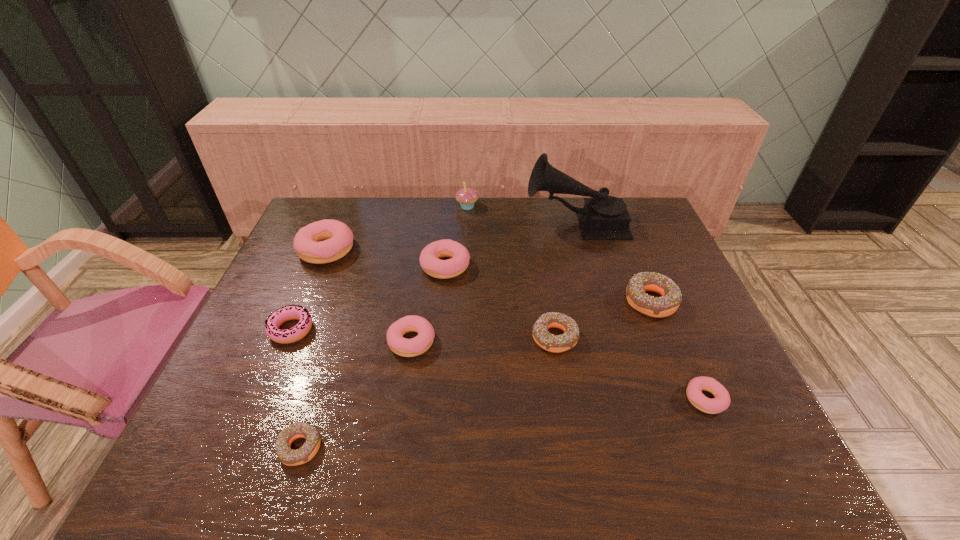
Find the location of a particular element. free spot between the pink cupcake and the tallest doughnut is located at coordinates (397, 228).

Find the location of a particular element. This screenshot has height=540, width=960. unoccupied position between the biggest pink doughnut and the smallest chocolate doughnut is located at coordinates (313, 349).

Locate an element on the screen. The image size is (960, 540). vacant area that lies between the nearest chocolate doughnut and the second biggest pink doughnut is located at coordinates (372, 357).

The width and height of the screenshot is (960, 540). What are the coordinates of `free space that is in between the second biggest pink doughnut and the leftmost chocolate doughnut` in the screenshot? It's located at (372, 357).

At what (x,y) coordinates should I click in order to perform the action: click on free space between the fourth smallest pink doughnut and the second tallest object. Please return your answer as a coordinate pair (x, y). The height and width of the screenshot is (540, 960). Looking at the image, I should click on (457, 237).

I want to click on vacant area between the second smallest chocolate doughnut and the tallest doughnut, so click(441, 294).

The image size is (960, 540). What are the coordinates of `object that is the seventh closest one to the black phonograph_record` in the screenshot? It's located at (325, 241).

Locate an element on the screen. The image size is (960, 540). object that ranks as the fifth closest to the nearest pink doughnut is located at coordinates (429, 258).

The image size is (960, 540). Find the location of `doughnut identified as the seventh closest to the ninth farthest object`. doughnut identified as the seventh closest to the ninth farthest object is located at coordinates (325, 241).

This screenshot has height=540, width=960. Find the location of `doughnut that is the closest to the third biggest pink doughnut`. doughnut that is the closest to the third biggest pink doughnut is located at coordinates (429, 258).